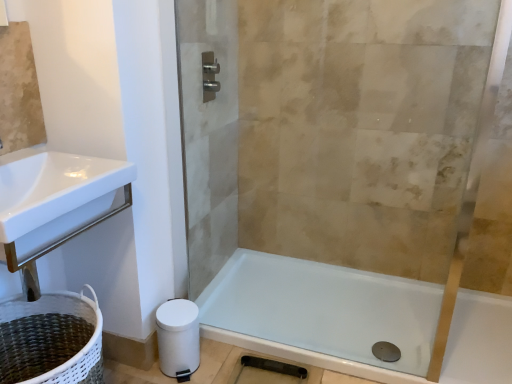
Question: From a real-world perspective, relative to satin nickel towel bar at upper center, is white glossy bathtub at lower right vertically above or below?

Choices:
 (A) below
 (B) above

Answer: (A)

Question: Considering their positions, is white glossy bathtub at lower right located in front of or behind satin nickel towel bar at upper center?

Choices:
 (A) front
 (B) behind

Answer: (A)

Question: Considering the real-world distances, which object is farthest from the clear glass shower door at center?

Choices:
 (A) satin nickel towel bar at upper center
 (B) white matte toilet paper at lower left
 (C) white glossy bathtub at lower right
 (D) white woven laundry basket at lower left

Answer: (D)

Question: Which is farther from the clear glass shower door at center?

Choices:
 (A) white woven laundry basket at lower left
 (B) white glossy bathtub at lower right
 (C) white matte toilet paper at lower left
 (D) satin nickel towel bar at upper center

Answer: (A)